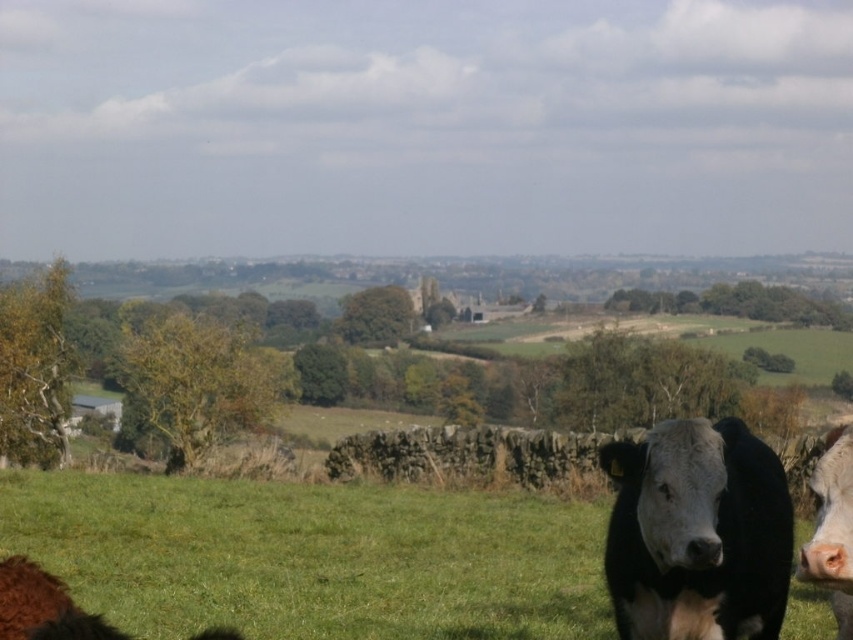
Find the location of `green grassy field at lower center`. green grassy field at lower center is located at coordinates (312, 556).

Is green grassy field at lower center positioned before brown fuzzy bull at lower left?

No.

This screenshot has width=853, height=640. What do you see at coordinates (312, 556) in the screenshot?
I see `green grassy field at lower center` at bounding box center [312, 556].

Where is `green grassy field at lower center`? The height and width of the screenshot is (640, 853). green grassy field at lower center is located at coordinates (312, 556).

Based on the photo, does black smooth cow at right have a lesser height compared to brown fuzzy bull at lower left?

In fact, black smooth cow at right may be taller than brown fuzzy bull at lower left.

In the scene shown: How distant is black smooth cow at right from brown fuzzy bull at lower left?

black smooth cow at right is 6.39 feet away from brown fuzzy bull at lower left.

Where is `black smooth cow at right`? The image size is (853, 640). black smooth cow at right is located at coordinates (697, 532).

Does green grassy field at lower center appear under black smooth cow at lower right?

Incorrect, green grassy field at lower center is not positioned below black smooth cow at lower right.

Who is more distant from viewer, (393,566) or (820,541)?

The point (393,566) is behind.

What are the coordinates of `green grassy field at lower center` in the screenshot? It's located at (312, 556).